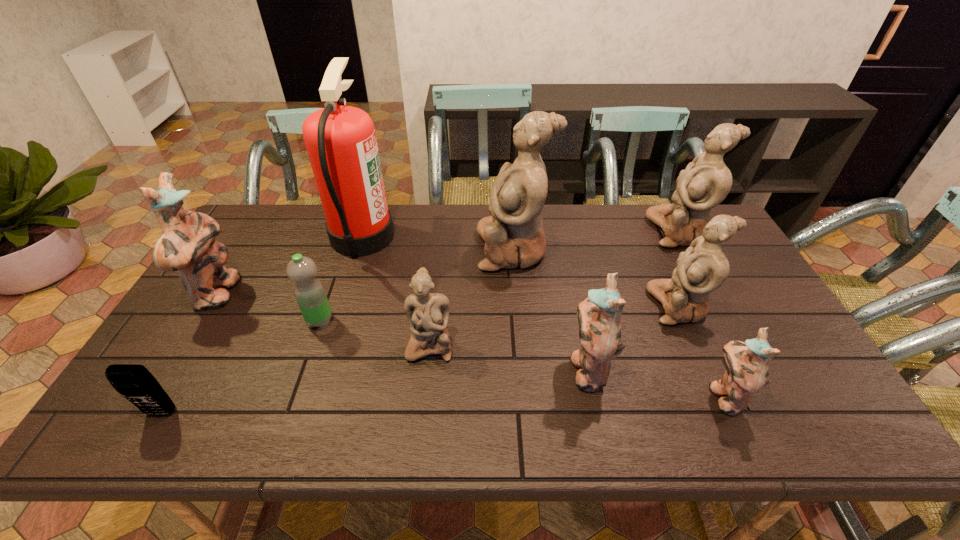
Find the location of a particular element. the second figurine from left to right is located at coordinates (428, 313).

You are a GUI agent. You are given a task and a screenshot of the screen. Output one action in this format:
    pyautogui.click(x=<x>, y=<y>)
    Task: Click on the smallest pink figurine
    
    Given the screenshot: What is the action you would take?
    point(747,373)

The image size is (960, 540). I want to click on cellular telephone, so click(134, 382).

In order to click on free space located at the nozzle of the red fire extinguisher in this screenshot , I will do `click(415, 236)`.

You are a GUI agent. You are given a task and a screenshot of the screen. Output one action in this format:
    pyautogui.click(x=<x>, y=<y>)
    Task: Click on the free space located 0.180m on the front-facing side of the second tallest object
    
    Given the screenshot: What is the action you would take?
    pyautogui.click(x=420, y=249)

At what (x,y) coordinates should I click in order to perform the action: click on free space located on the front-facing side of the second tallest object. Please return your answer as a coordinate pair (x, y). The height and width of the screenshot is (540, 960). Looking at the image, I should click on (380, 249).

Locate an element on the screen. The width and height of the screenshot is (960, 540). free spot located on the front-facing side of the second tallest object is located at coordinates (451, 249).

Find the location of a particular element. This screenshot has height=540, width=960. vacant area situated 0.290m on the front-facing side of the second biggest white figurine is located at coordinates (564, 232).

The height and width of the screenshot is (540, 960). What are the coordinates of `free spot located on the front-facing side of the second biggest white figurine` in the screenshot? It's located at (614, 232).

Locate an element on the screen. vacant area situated on the front-facing side of the second biggest white figurine is located at coordinates (547, 232).